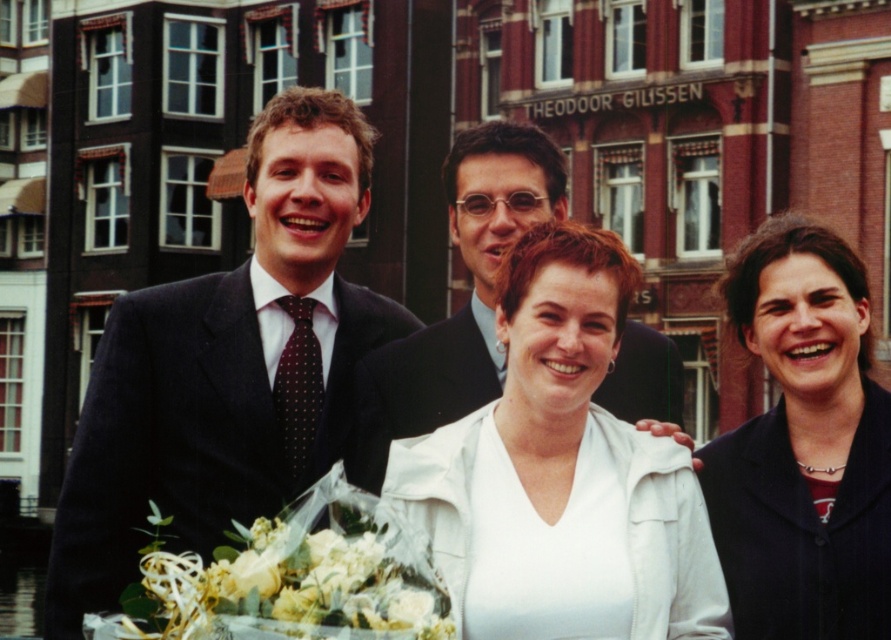
Question: Is dark suit at center below dark blue fabric at right?

Choices:
 (A) yes
 (B) no

Answer: (B)

Question: Can you confirm if matte black suit at center is thinner than white floral bouquet at center?

Choices:
 (A) no
 (B) yes

Answer: (A)

Question: Which of the following is the closest to the observer?

Choices:
 (A) (783, 493)
 (B) (503, 445)

Answer: (B)

Question: Which point is farther from the camera taking this photo?

Choices:
 (A) (854, 461)
 (B) (550, 556)

Answer: (A)

Question: Which object appears closest to the camera in this image?

Choices:
 (A) matte black suit at center
 (B) white floral bouquet at center
 (C) white matte jacket at center

Answer: (B)

Question: Can you confirm if dark suit at center is smaller than white floral bouquet at center?

Choices:
 (A) no
 (B) yes

Answer: (A)